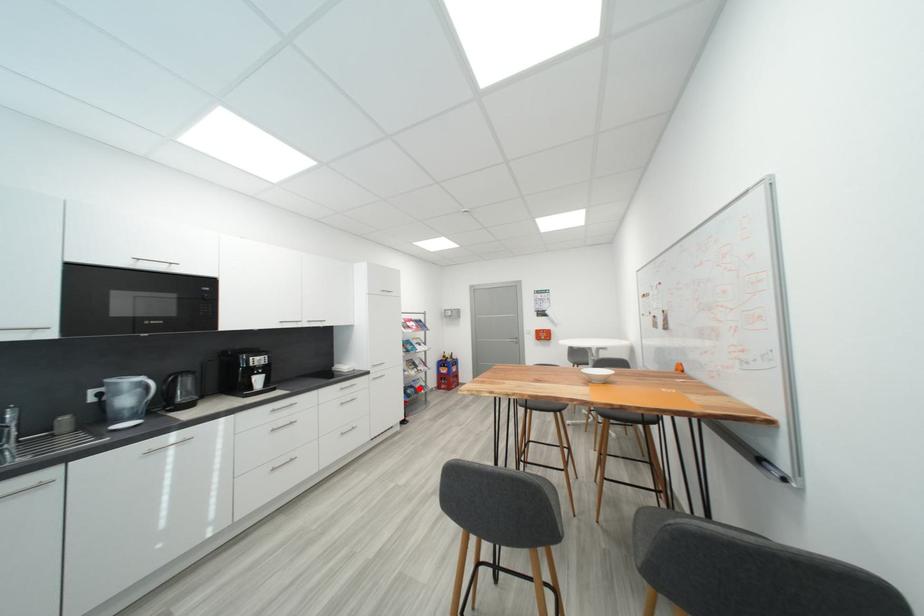
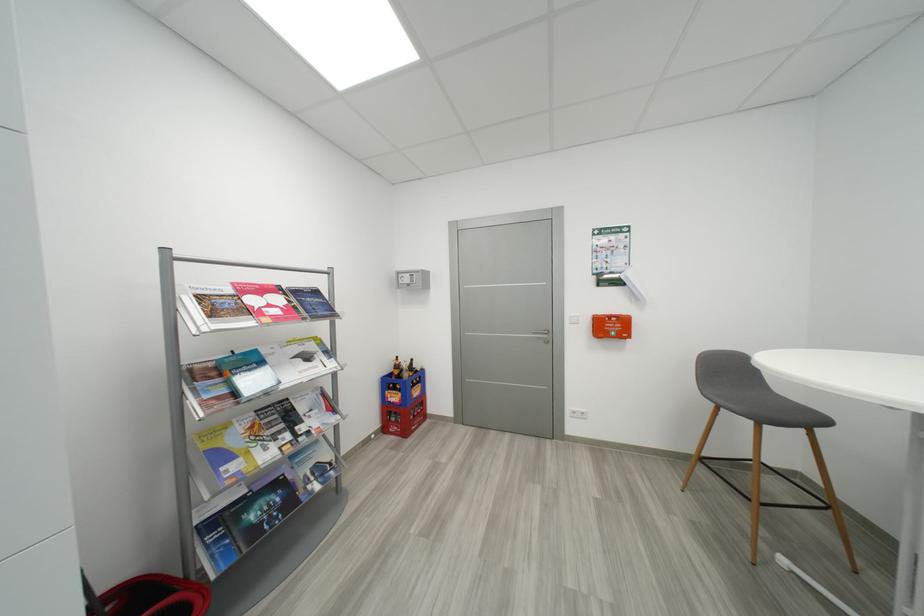
Question: I am providing you with two images of the same scene from different viewpoints. A red point is shown in image1. For the corresponding object point in image2, is it positioned nearer or farther from the camera?

Choices:
 (A) Nearer
 (B) Farther

Answer: (A)